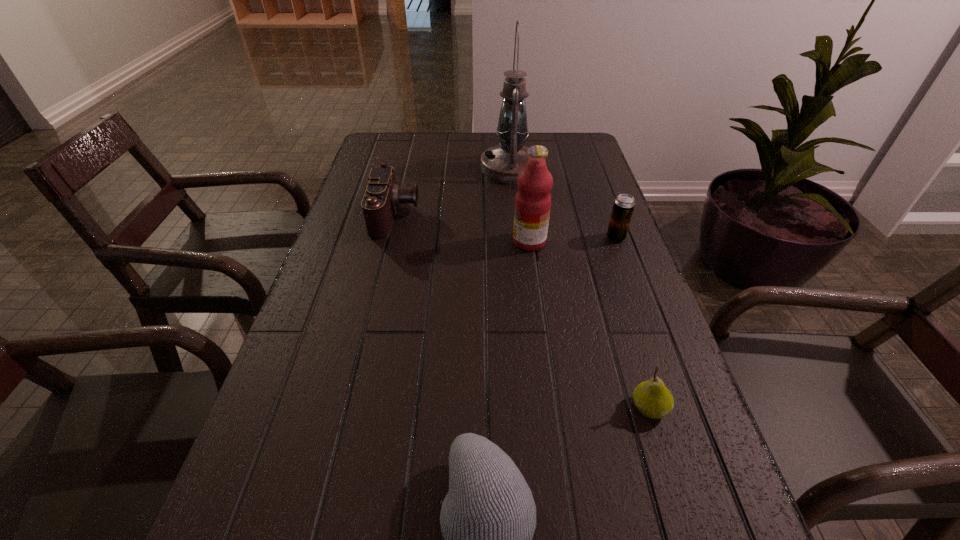
You are a GUI agent. You are given a task and a screenshot of the screen. Output one action in this format:
    pyautogui.click(x=<x>, y=<y>)
    Task: Click on the oil lamp
    
    Given the screenshot: What is the action you would take?
    pyautogui.click(x=502, y=163)

The image size is (960, 540). Identify the location of the farthest object. (502, 163).

You are a GUI agent. You are given a task and a screenshot of the screen. Output one action in this format:
    pyautogui.click(x=<x>, y=<y>)
    Task: Click on the fifth shortest object
    This screenshot has height=540, width=960.
    Given the screenshot: What is the action you would take?
    pyautogui.click(x=533, y=200)

At what (x,y) coordinates should I click in order to perform the action: click on beer can. Please return your answer as a coordinate pair (x, y). Image resolution: width=960 pixels, height=540 pixels. Looking at the image, I should click on (624, 204).

Locate an element on the screen. This screenshot has height=540, width=960. the leftmost object is located at coordinates (382, 197).

The width and height of the screenshot is (960, 540). Find the location of `the second nearest object`. the second nearest object is located at coordinates (652, 398).

Identify the location of vacant space situated on the left of the farthest object. This screenshot has height=540, width=960. (435, 168).

You are a GUI agent. You are given a task and a screenshot of the screen. Output one action in this format:
    pyautogui.click(x=<x>, y=<y>)
    Task: Click on the vacant space located 0.150m on the label of the fruit juice
    This screenshot has width=960, height=540.
    Given the screenshot: What is the action you would take?
    tap(452, 241)

You are a GUI agent. You are given a task and a screenshot of the screen. Output one action in this format:
    pyautogui.click(x=<x>, y=<y>)
    Task: Click on the vacant space located 0.150m on the label of the fruit juice
    The image size is (960, 540).
    Given the screenshot: What is the action you would take?
    pyautogui.click(x=452, y=241)

At what (x,y) coordinates should I click in order to perform the action: click on vacant point located 0.100m on the label of the fruit juice. Please return your answer as a coordinate pair (x, y). The width and height of the screenshot is (960, 540). Looking at the image, I should click on (472, 241).